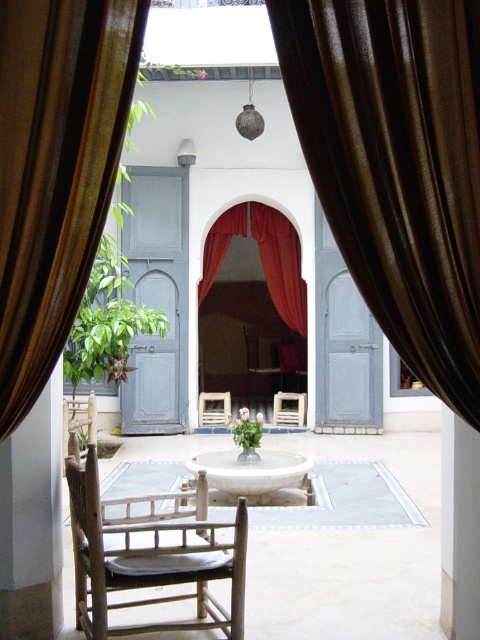
Question: Which point is farther to the camera?

Choices:
 (A) green glossy plant at center
 (B) brown silk curtain at center
 (C) wooden rocking chair at center
 (D) brown sheer curtain at left

Answer: (A)

Question: Can you confirm if brown silk curtain at center is thinner than wooden rocking chair at center?

Choices:
 (A) yes
 (B) no

Answer: (A)

Question: Which point appears closest to the camera in this image?

Choices:
 (A) (229, 548)
 (B) (277, 371)
 (C) (249, 444)

Answer: (A)

Question: Is brown silk curtain at center to the left of white marble table at center from the viewer's perspective?

Choices:
 (A) yes
 (B) no

Answer: (B)

Question: Can you confirm if brown sheer curtain at left is bigger than wooden chair at center?

Choices:
 (A) no
 (B) yes

Answer: (A)

Question: Which object appears closest to the camera in this image?

Choices:
 (A) brown sheer curtain at left
 (B) white marble table at center
 (C) brown silk curtain at center
 (D) wooden chair at lower left

Answer: (C)